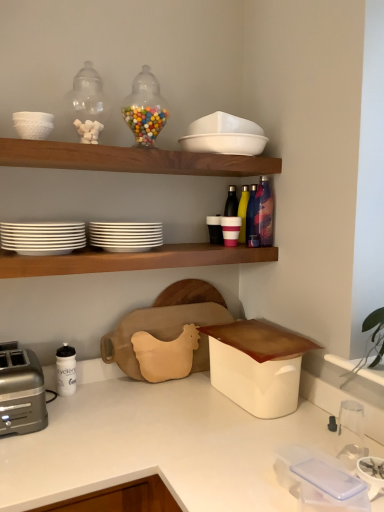
At what (x,y) coordinates should I click in order to perform the action: click on free region on the left part of metallic multi-colored bottle at upper right, the 1th bottle viewed from the front. Please return your answer as a coordinate pair (x, y). Image resolution: width=384 pixels, height=512 pixels. Looking at the image, I should click on (219, 247).